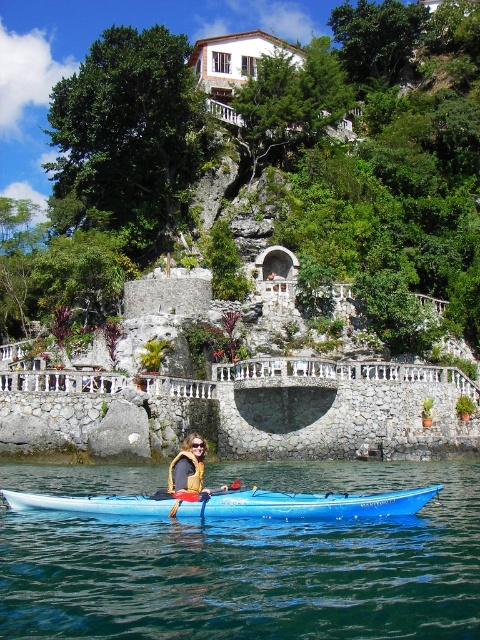
You are a photographer planning to take a photo of the kayaks in the serene scene. You need to ensure that both the blue rubber kayak at center and the blue plastic kayak at center are visible in the frame. Which kayak should you position your camera lower to capture?

You should position your camera lower to capture the blue rubber kayak at center because it is located below the blue plastic kayak at center.

You are a photographer planning to take a picture of the blue plastic kayak at center. The camera you are using has a focal length of 50mm. If you want to ensure the kayak is centered in the frame, what should you do based on its 2D coordinates?

Since the blue plastic kayak at center is already at the 2D coordinates point (232, 502), you should position the camera so that the kayak aligns with the center of the frame, which corresponds to the coordinates. Adjust your position or angle to ensure the kayak is centered at those coordinates for optimal framing.